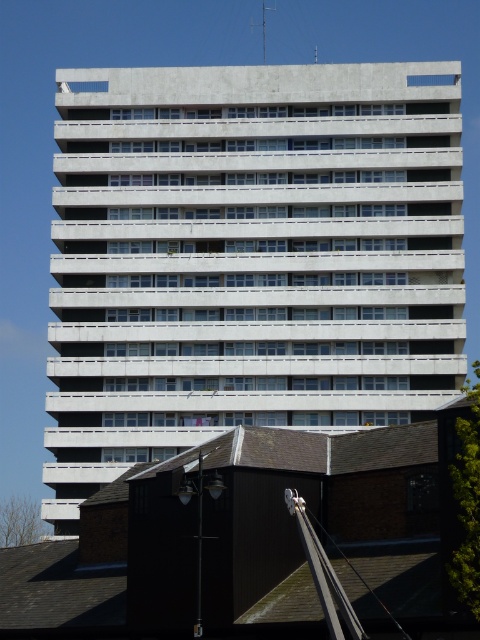
Question: Is the position of gray concrete building at center more distant than that of metallic silver crane at upper center?

Choices:
 (A) yes
 (B) no

Answer: (B)

Question: Is gray concrete building at center below metallic silver crane at upper center?

Choices:
 (A) yes
 (B) no

Answer: (A)

Question: Which point appears closest to the camera in this image?

Choices:
 (A) (264, 20)
 (B) (278, 387)

Answer: (B)

Question: Which point is farther to the camera?

Choices:
 (A) (199, 80)
 (B) (265, 8)

Answer: (B)

Question: Is gray concrete building at center bigger than metallic silver crane at upper center?

Choices:
 (A) no
 (B) yes

Answer: (B)